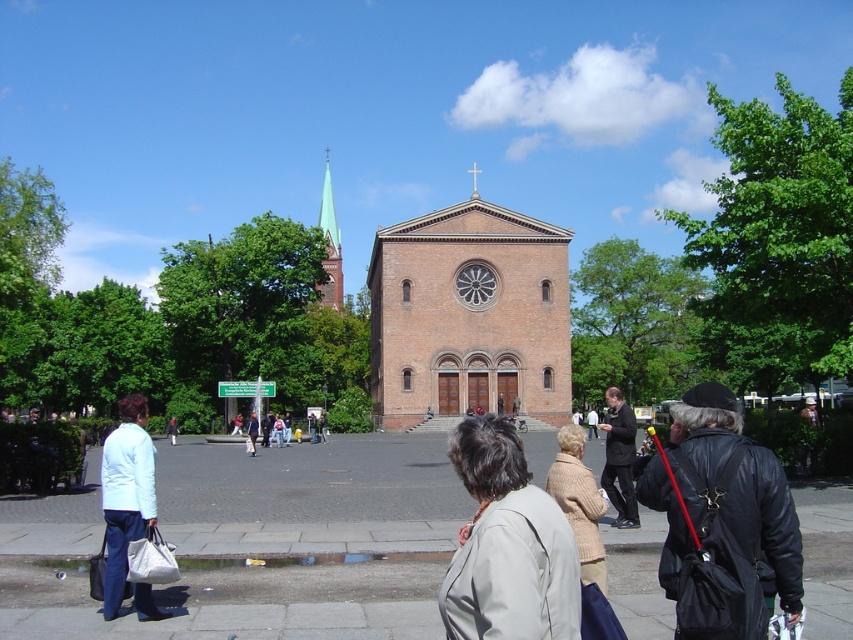
Who is higher up, light blue fabric jacket at lower left or green glass steeple at upper center?

green glass steeple at upper center is higher up.

Is light blue fabric jacket at lower left to the left of green glass steeple at upper center from the viewer's perspective?

Correct, you'll find light blue fabric jacket at lower left to the left of green glass steeple at upper center.

Locate an element on the screen. light blue fabric jacket at lower left is located at coordinates (125, 493).

I want to click on light blue fabric jacket at lower left, so click(125, 493).

Is the position of light beige jacket at lower center less distant than that of dark brown leather jacket at center?

Yes, it is.

Between point (508, 525) and point (624, 509), which one is positioned behind?

The point (624, 509) is behind.

I want to click on light beige jacket at lower center, so point(508,545).

Which of these two, black leather jacket at lower right or green glass steeple at upper center, stands shorter?

black leather jacket at lower right is shorter.

Who is more forward, (x=668, y=560) or (x=329, y=234)?

Positioned in front is point (x=668, y=560).

The image size is (853, 640). Find the location of `black leather jacket at lower right`. black leather jacket at lower right is located at coordinates (723, 522).